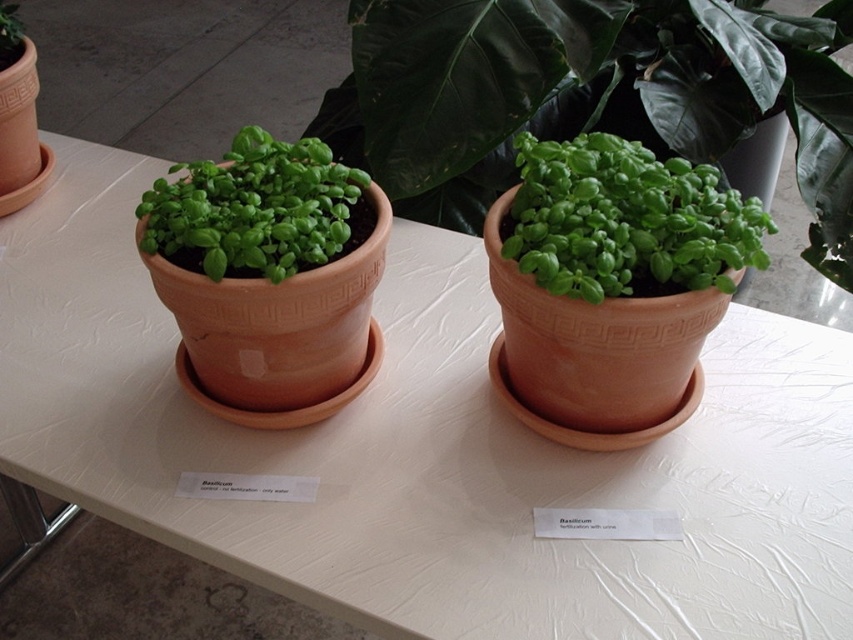
Based on the photo, is green matte basil at center above green matte basil at left?

No, green matte basil at center is not above green matte basil at left.

Does point (767, 220) lie behind point (280, 268)?

Yes.

Locate an element on the screen. Image resolution: width=853 pixels, height=640 pixels. green matte basil at center is located at coordinates (625, 220).

Does green matte pot at center appear under green matte basil at center?

No.

How distant is green matte pot at center from green matte basil at center?

green matte pot at center and green matte basil at center are 17.76 inches apart.

Between point (436, 182) and point (728, 204), which one is positioned behind?

Positioned behind is point (436, 182).

Identify the location of green matte pot at center. This screenshot has height=640, width=853. tap(589, 93).

Who is positioned more to the left, green matte pot at center or green matte basil at left?

Positioned to the left is green matte basil at left.

This screenshot has height=640, width=853. What are the coordinates of `green matte pot at center` in the screenshot? It's located at (589, 93).